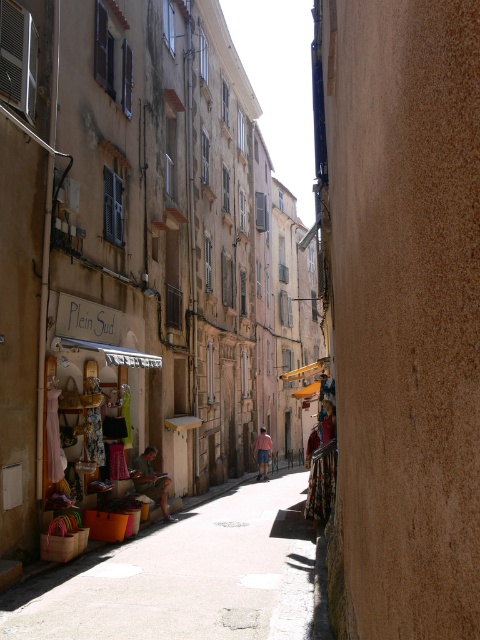
Question: Based on their relative distances, which object is farther from the wooden crates at lower left?

Choices:
 (A) pink cotton shorts at center
 (B) brown rough wall at right
 (C) matte brown building at center
 (D) light brown wooden chair at lower left

Answer: (A)

Question: Does matte brown building at center have a greater width compared to pink cotton shorts at center?

Choices:
 (A) no
 (B) yes

Answer: (B)

Question: Is brown rough wall at right to the right of pink cotton shorts at center from the viewer's perspective?

Choices:
 (A) no
 (B) yes

Answer: (B)

Question: Is matte brown building at center wider than wooden crates at lower left?

Choices:
 (A) yes
 (B) no

Answer: (A)

Question: Which object is positioned farthest from the light brown wooden chair at lower left?

Choices:
 (A) wooden crates at lower left
 (B) brown rough wall at right
 (C) pink cotton shorts at center

Answer: (C)

Question: Estimate the real-world distances between objects in this image. Which object is closer to the matte brown building at center?

Choices:
 (A) light brown wooden chair at lower left
 (B) brown rough wall at right
 (C) pink cotton shorts at center

Answer: (B)